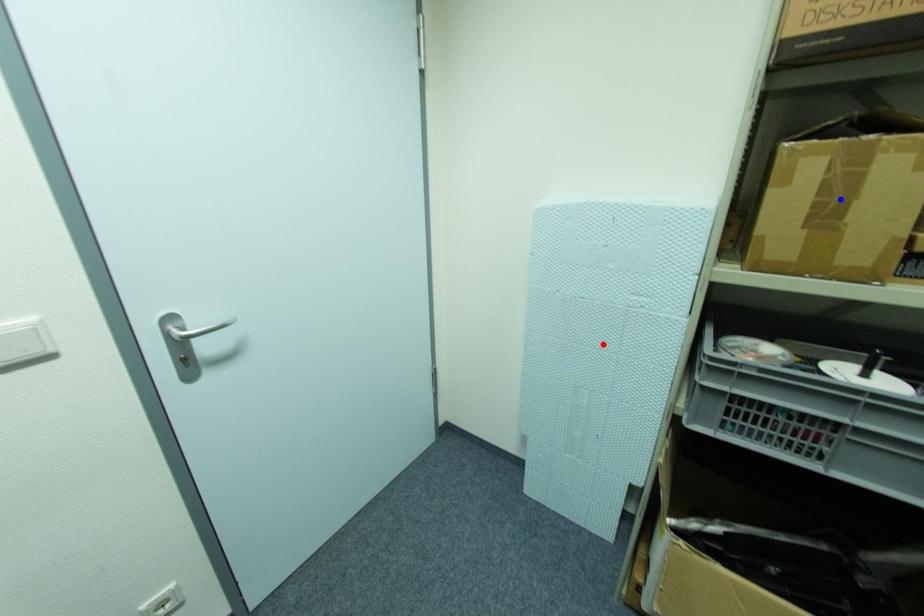
Question: In the image, two points are highlighted. Which point is nearer to the camera? Reply with the corresponding letter.

Choices:
 (A) blue point
 (B) red point

Answer: (A)